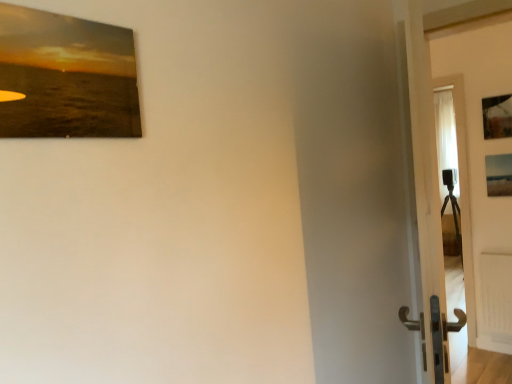
What do you see at coordinates (496, 297) in the screenshot? The width and height of the screenshot is (512, 384). I see `white matte radiator at lower right` at bounding box center [496, 297].

This screenshot has height=384, width=512. I want to click on white matte radiator at lower right, so click(496, 297).

At what (x,y) coordinates should I click in order to perform the action: click on wooden frame at upper right, which is counted as the 2th picture frame, starting from the left. Please return your answer as a coordinate pair (x, y). The width and height of the screenshot is (512, 384). Looking at the image, I should click on (497, 116).

Which object is positioned more to the left, white glossy door at right or white matte radiator at lower right?

Positioned to the left is white glossy door at right.

Is white glossy door at right inside or outside of white matte radiator at lower right?

white glossy door at right is outside white matte radiator at lower right.

From a real-world perspective, between white glossy door at right and white matte radiator at lower right, who is vertically lower?

white matte radiator at lower right, from a real-world perspective.

From a real-world perspective, relative to wooden frame at upper right, which is counted as the 2th picture frame, starting from the left, is matte wooden picture frame at upper left, the 2th picture frame in the top-to-bottom sequence, vertically above or below?

matte wooden picture frame at upper left, the 2th picture frame in the top-to-bottom sequence, is situated lower than wooden frame at upper right, which is counted as the 2th picture frame, starting from the left, in the real world.

Considering the relative positions of matte wooden picture frame at upper left, which is the 1th picture frame from front to back, and wooden frame at upper right, which is counted as the second picture frame, starting from the front, in the image provided, is matte wooden picture frame at upper left, which is the 1th picture frame from front to back, in front of wooden frame at upper right, which is counted as the second picture frame, starting from the front,?

Yes, it is in front of wooden frame at upper right, which is counted as the second picture frame, starting from the front.

Is matte wooden picture frame at upper left, positioned as the third picture frame in back-to-front order, oriented towards wooden frame at upper right, which is the first picture frame in top-to-bottom order?

No, matte wooden picture frame at upper left, positioned as the third picture frame in back-to-front order, is not aimed at wooden frame at upper right, which is the first picture frame in top-to-bottom order.

Is matte wooden picture frame at right, the 3th picture frame when ordered from top to bottom, in front of or behind white matte radiator at lower right in the image?

Clearly, matte wooden picture frame at right, the 3th picture frame when ordered from top to bottom, is in front of white matte radiator at lower right.

Is matte wooden picture frame at right, which appears as the 1th picture frame when ordered from the bottom, taller or shorter than white matte radiator at lower right?

In the image, matte wooden picture frame at right, which appears as the 1th picture frame when ordered from the bottom, appears to be shorter than white matte radiator at lower right.

Is point (493, 182) farther from camera compared to point (490, 267)?

No.

Is white glossy door at right wider or thinner than matte wooden picture frame at right, the 3th picture frame in the left-to-right sequence?

Clearly, white glossy door at right has more width compared to matte wooden picture frame at right, the 3th picture frame in the left-to-right sequence.

From the image's perspective, which is above, white glossy door at right or matte wooden picture frame at right, the 3th picture frame in the left-to-right sequence?

matte wooden picture frame at right, the 3th picture frame in the left-to-right sequence.

From a real-world perspective, is white glossy door at right positioned over matte wooden picture frame at right, which appears as the 1th picture frame when ordered from the bottom, based on gravity?

Actually, white glossy door at right is physically below matte wooden picture frame at right, which appears as the 1th picture frame when ordered from the bottom, in the real world.

Which is in front, point (488, 114) or point (511, 180)?

The point (488, 114) is closer.

Can you confirm if wooden frame at upper right, which is the first picture frame in top-to-bottom order, is taller than matte wooden picture frame at right, which appears as the 1th picture frame when ordered from the bottom?

Indeed, wooden frame at upper right, which is the first picture frame in top-to-bottom order, has a greater height compared to matte wooden picture frame at right, which appears as the 1th picture frame when ordered from the bottom.

From the picture: How many degrees apart are the facing directions of wooden frame at upper right, which is counted as the 2th picture frame, starting from the left, and matte wooden picture frame at right, which appears as the 1th picture frame when ordered from the bottom?

0.00155 degrees separate the facing orientations of wooden frame at upper right, which is counted as the 2th picture frame, starting from the left, and matte wooden picture frame at right, which appears as the 1th picture frame when ordered from the bottom.

Looking at this image, is wooden frame at upper right, positioned as the second picture frame in right-to-left order, not inside matte wooden picture frame at right, which appears as the 1th picture frame when ordered from the bottom?

wooden frame at upper right, positioned as the second picture frame in right-to-left order, lies outside matte wooden picture frame at right, which appears as the 1th picture frame when ordered from the bottom,'s area.

Considering the positions of objects matte wooden picture frame at right, the 3th picture frame when ordered from top to bottom, and wooden frame at upper right, which is counted as the second picture frame, starting from the front, in the image provided, who is in front, matte wooden picture frame at right, the 3th picture frame when ordered from top to bottom, or wooden frame at upper right, which is counted as the second picture frame, starting from the front,?

Positioned in front is wooden frame at upper right, which is counted as the second picture frame, starting from the front.

Consider the image. From the image's perspective, which is above, matte wooden picture frame at right, the 3th picture frame when ordered from top to bottom, or wooden frame at upper right, which ranks as the 3th picture frame in bottom-to-top order?

From the image's view, wooden frame at upper right, which ranks as the 3th picture frame in bottom-to-top order, is above.

Is matte wooden picture frame at right, positioned as the third picture frame in front-to-back order, positioned beyond the bounds of wooden frame at upper right, which is counted as the 2th picture frame, starting from the left?

matte wooden picture frame at right, positioned as the third picture frame in front-to-back order, is positioned outside wooden frame at upper right, which is counted as the 2th picture frame, starting from the left.

Based on the photo, from a real-world perspective, is matte wooden picture frame at right, which is counted as the 1th picture frame, starting from the right, beneath matte wooden picture frame at upper left, which is the 1th picture frame from front to back?

Yes, from a real-world perspective, matte wooden picture frame at right, which is counted as the 1th picture frame, starting from the right, is below matte wooden picture frame at upper left, which is the 1th picture frame from front to back.

Can you confirm if matte wooden picture frame at right, positioned as the 1th picture frame in back-to-front order, is bigger than matte wooden picture frame at upper left, the second picture frame ordered from the bottom?

Yes, matte wooden picture frame at right, positioned as the 1th picture frame in back-to-front order, is bigger than matte wooden picture frame at upper left, the second picture frame ordered from the bottom.

From the image's perspective, which one is positioned higher, matte wooden picture frame at right, positioned as the third picture frame in front-to-back order, or matte wooden picture frame at upper left, positioned as the third picture frame in back-to-front order?

matte wooden picture frame at upper left, positioned as the third picture frame in back-to-front order.

This screenshot has width=512, height=384. Identify the location of radiator beneath the white glossy door at right (from a real-world perspective). (496, 297).

In the image, there is a matte wooden picture frame at upper left, positioned as the third picture frame in back-to-front order. At what (x,y) coordinates should I click in order to perform the action: click on picture frame above it (from the image's perspective). Please return your answer as a coordinate pair (x, y). The height and width of the screenshot is (384, 512). Looking at the image, I should click on (497, 116).

Considering their positions, is wooden frame at upper right, which appears as the 2th picture frame when viewed from the back, positioned further to white matte radiator at lower right than matte wooden picture frame at right, the 3th picture frame when ordered from top to bottom?

Among the two, wooden frame at upper right, which appears as the 2th picture frame when viewed from the back, is located further to white matte radiator at lower right.

Looking at the image, which one is located further to wooden frame at upper right, which appears as the 2th picture frame when viewed from the back, matte wooden picture frame at upper left, the 1th picture frame positioned from the left, or white glossy door at right?

matte wooden picture frame at upper left, the 1th picture frame positioned from the left, is positioned further to the anchor wooden frame at upper right, which appears as the 2th picture frame when viewed from the back.

Estimate the real-world distances between objects in this image. Which object is further from wooden frame at upper right, which ranks as the 3th picture frame in bottom-to-top order, white glossy door at right or white matte radiator at lower right?

white glossy door at right.

Estimate the real-world distances between objects in this image. Which object is closer to wooden frame at upper right, which ranks as the 3th picture frame in bottom-to-top order, matte wooden picture frame at right, positioned as the 1th picture frame in back-to-front order, or white matte radiator at lower right?

matte wooden picture frame at right, positioned as the 1th picture frame in back-to-front order, is positioned closer to the anchor wooden frame at upper right, which ranks as the 3th picture frame in bottom-to-top order.

Which object lies nearer to the anchor point white matte radiator at lower right, white glossy door at right or matte wooden picture frame at right, positioned as the third picture frame in front-to-back order?

matte wooden picture frame at right, positioned as the third picture frame in front-to-back order.

Which object lies further to the anchor point white matte radiator at lower right, white glossy door at right or wooden frame at upper right, which appears as the 2th picture frame when viewed from the back?

white glossy door at right.

Estimate the real-world distances between objects in this image. Which object is further from wooden frame at upper right, which is the first picture frame in top-to-bottom order, matte wooden picture frame at upper left, which is the 1th picture frame from front to back, or white matte radiator at lower right?

Based on the image, matte wooden picture frame at upper left, which is the 1th picture frame from front to back, appears to be further to wooden frame at upper right, which is the first picture frame in top-to-bottom order.

When comparing their distances from white matte radiator at lower right, does matte wooden picture frame at right, which appears as the 1th picture frame when ordered from the bottom, or matte wooden picture frame at upper left, the 3th picture frame from the right, seem closer?

matte wooden picture frame at right, which appears as the 1th picture frame when ordered from the bottom.

Image resolution: width=512 pixels, height=384 pixels. In order to click on door between matte wooden picture frame at upper left, which is the 1th picture frame from front to back, and white matte radiator at lower right in the front-back direction in this screenshot , I will do (x=423, y=167).

You are a GUI agent. You are given a task and a screenshot of the screen. Output one action in this format:
    pyautogui.click(x=<x>, y=<y>)
    Task: Click on the picture frame located between matte wooden picture frame at upper left, the second picture frame ordered from the bottom, and matte wooden picture frame at right, positioned as the third picture frame in front-to-back order, in the depth direction
    This screenshot has width=512, height=384.
    Given the screenshot: What is the action you would take?
    pyautogui.click(x=497, y=116)

At what (x,y) coordinates should I click in order to perform the action: click on picture frame between white glossy door at right and matte wooden picture frame at right, the 3th picture frame when ordered from top to bottom, from front to back. Please return your answer as a coordinate pair (x, y). This screenshot has height=384, width=512. Looking at the image, I should click on (497, 116).

Locate an element on the screen. The height and width of the screenshot is (384, 512). door between matte wooden picture frame at upper left, which is the 1th picture frame from front to back, and wooden frame at upper right, which ranks as the 3th picture frame in bottom-to-top order, in the front-back direction is located at coordinates (423, 167).